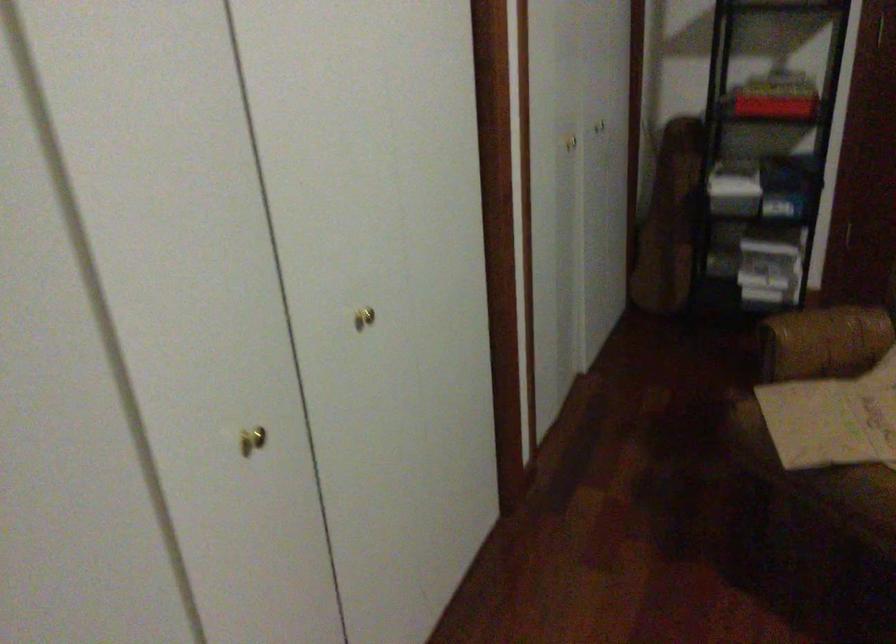
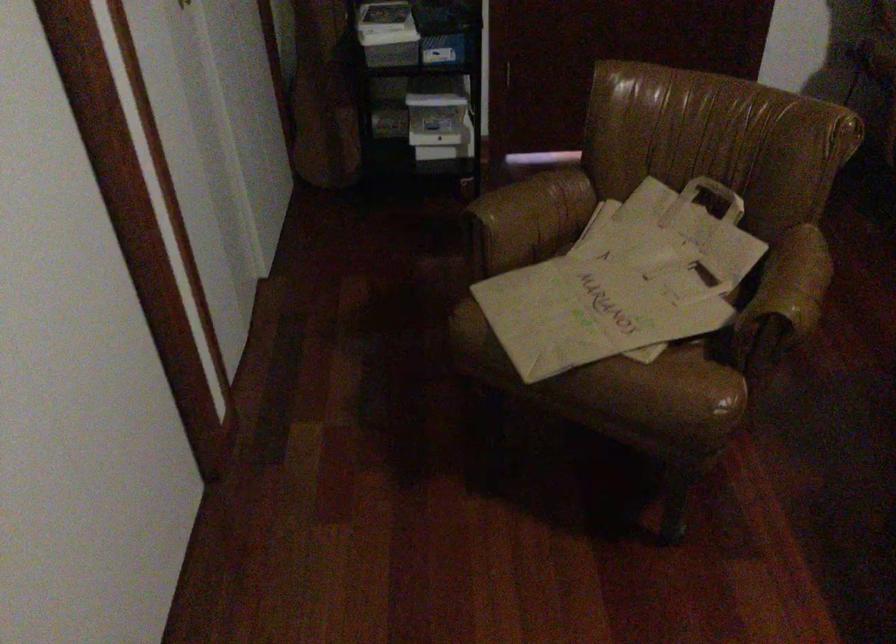
Locate, in the second image, the point that corresponds to (825,345) in the first image.

(532, 216)